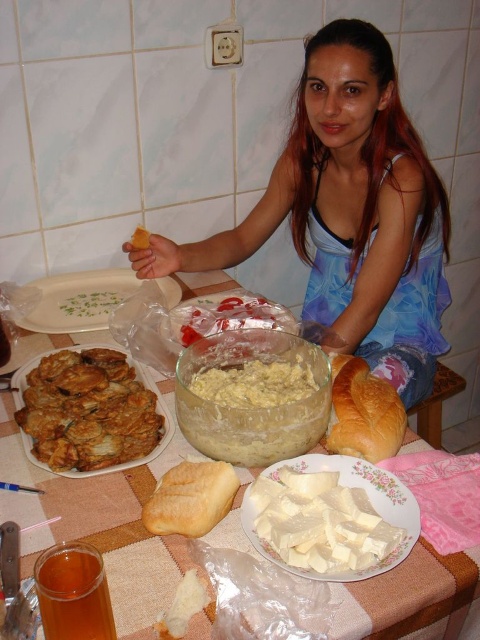
You are a waiter trying to place two items on the table in the image. The first item must be placed at point (x=268, y=401) and the second item at point (x=181, y=465). Which point is closer to the edge of the table?

A: Point (x=181, y=465) is closer to the edge of the table because it is positioned further away from the viewer compared to point (x=268, y=401).

You are a guest at this table and want to reach both the white creamy dip at center and the golden soft bread at center. Which one should you grab first if you want to take the larger item?

The white creamy dip at center is larger in size than the golden soft bread at center, so you should grab the white creamy dip at center first.

You are a photographer trying to capture the perfect shot of the scene. You want to focus on both the point at coordinates point [342,227] and the point at coordinates point [207,339]. Which point should you adjust your camera focus to first to ensure both are in the frame?

Point [342,227] is further to the viewer than point [207,339], so you should focus on point [342,227] first to ensure both points are within the camera frame.